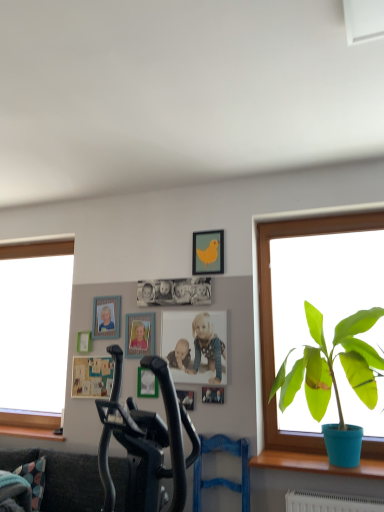
Question: From their relative heights in the image, would you say matte green picture frame at upper left, the 1th picture frame in the left-to-right sequence, is taller or shorter than blue fabric swivel chair at center?

Choices:
 (A) short
 (B) tall

Answer: (A)

Question: Would you say matte green picture frame at upper left, which ranks as the seventh picture frame in right-to-left order, is inside or outside blue fabric swivel chair at center?

Choices:
 (A) outside
 (B) inside

Answer: (A)

Question: Which object is positioned closest to the wooden at lower left?

Choices:
 (A) metallic silver photo frame at center, the 7th picture frame from the left
 (B) wooden picture frame at center, acting as the fourth picture frame starting from the left
 (C) blue fabric swivel chair at center
 (D) matte yellow picture frame at upper center, which ranks as the sixth picture frame in left-to-right order
 (E) wooden photo frame at lower left, the 2th picture frame in the left-to-right sequence

Answer: (E)

Question: Which object is positioned closest to the wooden at lower left?

Choices:
 (A) wooden picture frame at center, the 4th picture frame viewed from the right
 (B) matte yellow picture frame at upper center, which ranks as the sixth picture frame in left-to-right order
 (C) matte photo frame at center
 (D) dark gray fabric couch at lower left
 (E) green matte plant at right

Answer: (D)